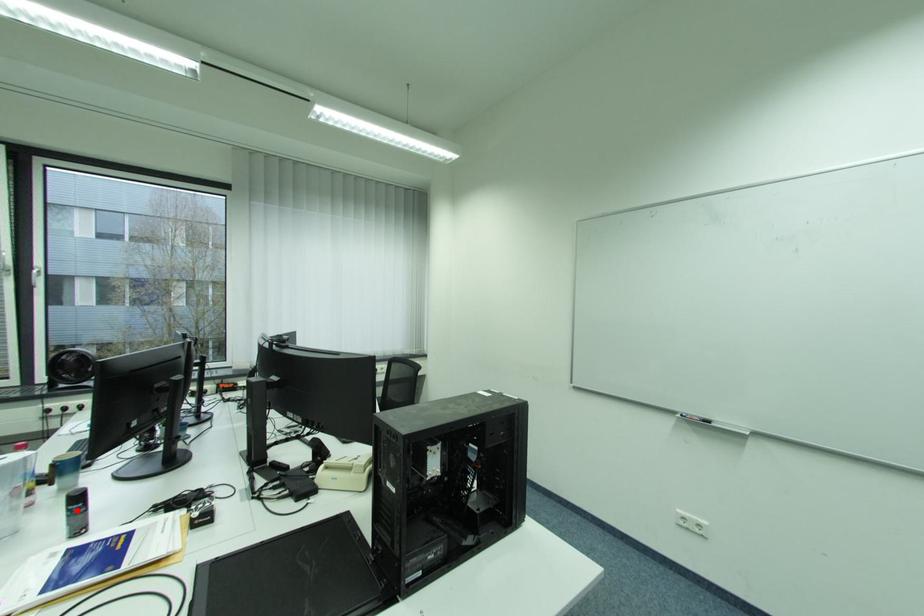
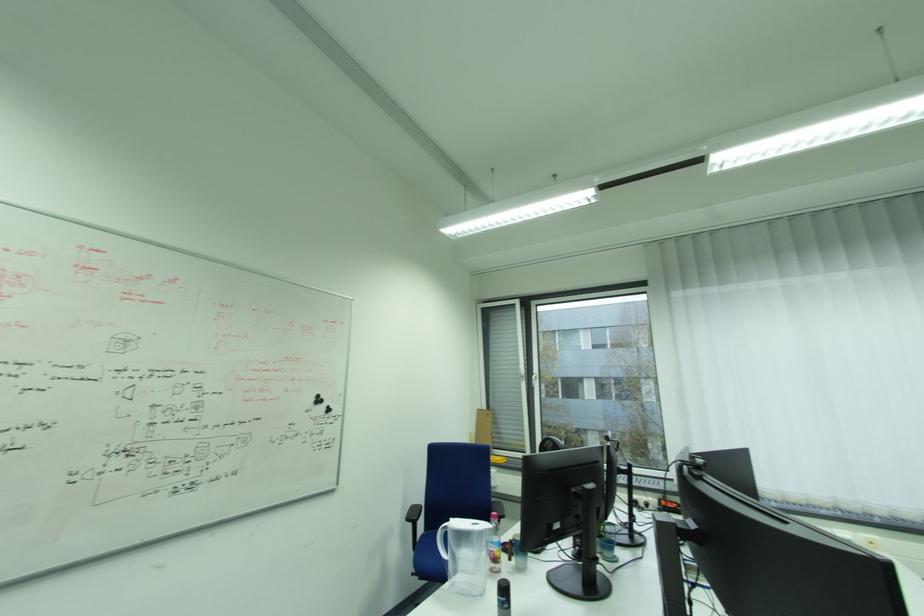
Question: I am providing you with two images of the same scene from different viewpoints. Given a red point in image1, look at the same physical point in image2. Is it:

Choices:
 (A) Closer to the viewpoint
 (B) Farther from the viewpoint

Answer: (B)